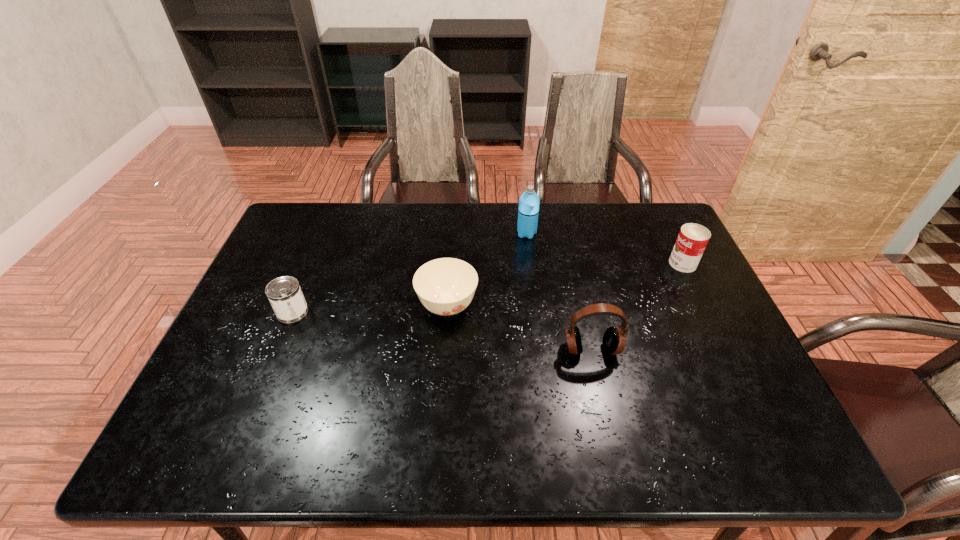
Locate an element on the screen. This screenshot has height=540, width=960. free space between the thermos bottle and the taller can is located at coordinates (605, 248).

What are the coordinates of `free space between the second object from left to right and the rightmost object` in the screenshot? It's located at (565, 285).

Find the location of a particular element. The width and height of the screenshot is (960, 540). unoccupied position between the rightmost object and the nearest object is located at coordinates (637, 306).

Image resolution: width=960 pixels, height=540 pixels. Identify the location of vacant area that lies between the sugar bowl and the second tallest object. (519, 328).

You are a GUI agent. You are given a task and a screenshot of the screen. Output one action in this format:
    pyautogui.click(x=<x>, y=<y>)
    Task: Click on the free point between the shorter can and the second object from left to right
    The width and height of the screenshot is (960, 540).
    Given the screenshot: What is the action you would take?
    pyautogui.click(x=370, y=309)

Locate an element on the screen. the closest object to the nearer can is located at coordinates (446, 286).

Identify which object is the third closest to the right can. Please provide its 2D coordinates. Your answer should be formatted as a tuple, i.e. [(x, y)], where the tuple contains the x and y coordinates of a point satisfying the conditions above.

[(446, 286)]

What are the coordinates of `free region that satisfies the following two spatial constraints: 1. on the front label of the taller can; 2. on the ear pads of the fourth shortest object` in the screenshot? It's located at (725, 349).

The width and height of the screenshot is (960, 540). Identify the location of free space that satisfies the following two spatial constraints: 1. on the front label of the right can; 2. on the front side of the sugar bowl. (704, 307).